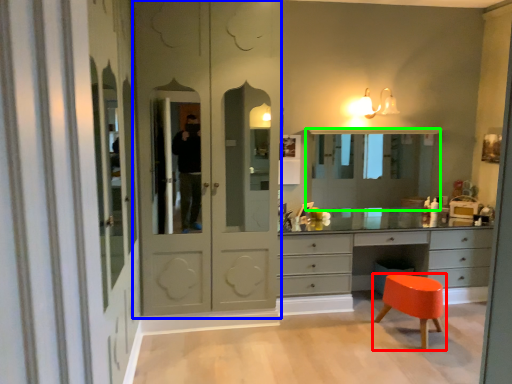
Question: Estimate the real-world distances between objects in this image. Which object is farther from stool (highlighted by a red box), screen door (highlighted by a blue box) or medicine cabinet (highlighted by a green box)?

Choices:
 (A) screen door
 (B) medicine cabinet

Answer: (A)